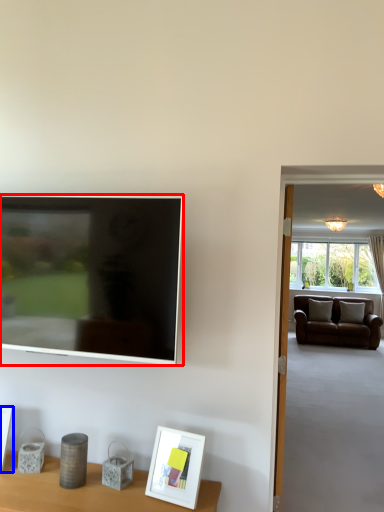
Question: Among these objects, which one is nearest to the camera, television (highlighted by a red box) or picture frame (highlighted by a blue box)?

Choices:
 (A) television
 (B) picture frame

Answer: (A)